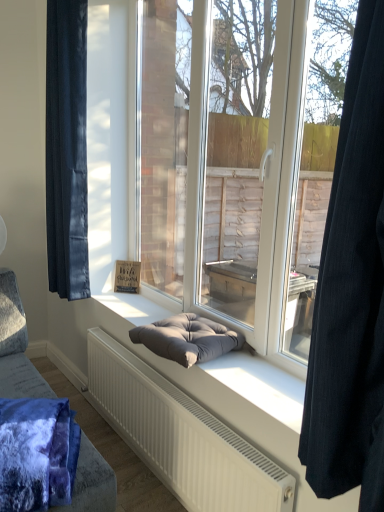
Describe the element at coordinates (241, 160) in the screenshot. I see `matte gray cushion at center` at that location.

Where is `velvet dark blue curtain at left, which appears as the 2th curtain when viewed from the right`? The height and width of the screenshot is (512, 384). velvet dark blue curtain at left, which appears as the 2th curtain when viewed from the right is located at coordinates (67, 149).

Describe the element at coordinates (187, 339) in the screenshot. This screenshot has height=512, width=384. I see `dark gray fabric footrest at center` at that location.

This screenshot has height=512, width=384. I want to click on dark gray cushion at center, so click(261, 385).

Identify the location of black fabric curtain at right, placed as the 1th curtain when sorted from right to left. (351, 292).

What are the coordinates of `matte gray cushion at center` in the screenshot? It's located at (241, 160).

Measure the distance between velvety blue blanket at lower left and matte gray cushion at center.

1.06 meters.

Is velvety blue blanket at lower left next to matte gray cushion at center?

velvety blue blanket at lower left is not next to matte gray cushion at center, and they're not touching.

Consider the image. Considering the relative sizes of velvety blue blanket at lower left and matte gray cushion at center in the image provided, is velvety blue blanket at lower left smaller than matte gray cushion at center?

Correct, velvety blue blanket at lower left occupies less space than matte gray cushion at center.

Which object is positioned more to the right, velvety blue blanket at lower left or matte gray cushion at center?

matte gray cushion at center.

Is matte gray cushion at center not close to black fabric curtain at right, the 2th curtain viewed from the left?

Absolutely, matte gray cushion at center is distant from black fabric curtain at right, the 2th curtain viewed from the left.

Find the location of a particular element. window on the left side of black fabric curtain at right, the 2th curtain viewed from the left is located at coordinates (241, 160).

From the image's perspective, is matte gray cushion at center below black fabric curtain at right, arranged as the 1th curtain when viewed from the front?

Actually, matte gray cushion at center appears above black fabric curtain at right, arranged as the 1th curtain when viewed from the front, in the image.

Between matte gray cushion at center and black fabric curtain at right, arranged as the 1th curtain when viewed from the front, which one is positioned behind?

matte gray cushion at center is further away from the camera.

Which of these two, matte gray cushion at center or velvety blue blanket at lower left, is thinner?

Thinner between the two is matte gray cushion at center.

Is point (295, 257) closer to viewer compared to point (14, 417)?

No, it is behind (14, 417).

In the scene shown: Is matte gray cushion at center looking in the opposite direction of velvety blue blanket at lower left?

No.

From the image's perspective, relative to velvety blue blanket at lower left, is matte gray cushion at center above or below?

Clearly, from the image's perspective, matte gray cushion at center is above velvety blue blanket at lower left.

Which is in front, velvet dark blue curtain at left, arranged as the first curtain when viewed from the left, or matte gray cushion at center?

matte gray cushion at center is closer to the camera.

Does velvet dark blue curtain at left, which is the second curtain from front to back, turn towards matte gray cushion at center?

No, velvet dark blue curtain at left, which is the second curtain from front to back, does not turn towards matte gray cushion at center.

How many degrees apart are the facing directions of velvet dark blue curtain at left, which appears as the 2th curtain when viewed from the right, and matte gray cushion at center?

They differ by 0.000116 degrees in their facing directions.

Are black fabric curtain at right, the 2th curtain viewed from the left, and velvety blue blanket at lower left far apart?

They are positioned close to each other.

Could you tell me if black fabric curtain at right, the 2th curtain viewed from the left, is turned towards velvety blue blanket at lower left?

No, black fabric curtain at right, the 2th curtain viewed from the left, is not turned towards velvety blue blanket at lower left.

From a real-world perspective, does black fabric curtain at right, the 2th curtain viewed from the left, stand above velvety blue blanket at lower left?

Yes.

Considering the relative sizes of velvet dark blue curtain at left, which appears as the 2th curtain when viewed from the right, and dark gray cushion at center in the image provided, is velvet dark blue curtain at left, which appears as the 2th curtain when viewed from the right, bigger than dark gray cushion at center?

Yes.

This screenshot has height=512, width=384. I want to click on curtain located behind the dark gray cushion at center, so [67, 149].

From the image's perspective, between velvet dark blue curtain at left, which is the second curtain from front to back, and dark gray cushion at center, who is located below?

dark gray cushion at center appears lower in the image.

Is velvet dark blue curtain at left, arranged as the first curtain when viewed from the left, taller than dark gray cushion at center?

Yes.

Looking at their sizes, would you say dark gray fabric footrest at center is wider or thinner than velvet dark blue curtain at left, the first curtain when ordered from back to front?

In the image, dark gray fabric footrest at center appears to be wider than velvet dark blue curtain at left, the first curtain when ordered from back to front.

How far apart are dark gray fabric footrest at center and velvet dark blue curtain at left, the first curtain when ordered from back to front?

dark gray fabric footrest at center is 36.82 inches from velvet dark blue curtain at left, the first curtain when ordered from back to front.

Between dark gray fabric footrest at center and velvet dark blue curtain at left, which appears as the 2th curtain when viewed from the right, which one appears on the left side from the viewer's perspective?

Positioned to the left is velvet dark blue curtain at left, which appears as the 2th curtain when viewed from the right.

Are dark gray fabric footrest at center and velvet dark blue curtain at left, which appears as the 2th curtain when viewed from the right, located far from each other?

dark gray fabric footrest at center is actually quite close to velvet dark blue curtain at left, which appears as the 2th curtain when viewed from the right.

Where is `window that is above the velvety blue blanket at lower left (from the image's perspective)`? window that is above the velvety blue blanket at lower left (from the image's perspective) is located at coordinates (241, 160).

Where is `window above the black fabric curtain at right, placed as the 1th curtain when sorted from right to left (from a real-world perspective)`? This screenshot has height=512, width=384. window above the black fabric curtain at right, placed as the 1th curtain when sorted from right to left (from a real-world perspective) is located at coordinates (241, 160).

Looking at the image, which one is located closer to matte gray cushion at center, velvet dark blue curtain at left, which is the second curtain from front to back, or dark gray fabric footrest at center?

Among the two, dark gray fabric footrest at center is located nearer to matte gray cushion at center.

Estimate the real-world distances between objects in this image. Which object is further from black fabric curtain at right, placed as the 1th curtain when sorted from right to left, dark gray cushion at center or dark gray fabric footrest at center?

The object further to black fabric curtain at right, placed as the 1th curtain when sorted from right to left, is dark gray fabric footrest at center.

Which object lies further to the anchor point dark gray fabric footrest at center, black fabric curtain at right, the 2th curtain viewed from the left, or velvet dark blue curtain at left, which appears as the 2th curtain when viewed from the right?

velvet dark blue curtain at left, which appears as the 2th curtain when viewed from the right, is further to dark gray fabric footrest at center.

Consider the image. Considering their positions, is dark gray cushion at center positioned further to dark gray fabric footrest at center than black fabric curtain at right, placed as the 1th curtain when sorted from right to left?

black fabric curtain at right, placed as the 1th curtain when sorted from right to left.

When comparing their distances from velvety blue blanket at lower left, does dark gray fabric footrest at center or dark gray cushion at center seem closer?

The object closer to velvety blue blanket at lower left is dark gray fabric footrest at center.

Estimate the real-world distances between objects in this image. Which object is further from velvet dark blue curtain at left, arranged as the first curtain when viewed from the left, dark gray cushion at center or dark gray fabric footrest at center?

Based on the image, dark gray cushion at center appears to be further to velvet dark blue curtain at left, arranged as the first curtain when viewed from the left.

Considering their positions, is black fabric curtain at right, the 2th curtain viewed from the left, positioned closer to dark gray cushion at center than velvet dark blue curtain at left, which is the second curtain from front to back?

The object closer to dark gray cushion at center is black fabric curtain at right, the 2th curtain viewed from the left.

Considering their positions, is dark gray fabric footrest at center positioned closer to black fabric curtain at right, placed as the 1th curtain when sorted from right to left, than velvety blue blanket at lower left?

Among the two, dark gray fabric footrest at center is located nearer to black fabric curtain at right, placed as the 1th curtain when sorted from right to left.

I want to click on curtain between matte gray cushion at center and velvety blue blanket at lower left in the vertical direction, so click(351, 292).

This screenshot has height=512, width=384. Identify the location of footrest between velvet dark blue curtain at left, the first curtain when ordered from back to front, and dark gray cushion at center in the up-down direction. (187, 339).

Find the location of a particular element. This screenshot has height=512, width=384. window sill between matte gray cushion at center and velvety blue blanket at lower left in the vertical direction is located at coordinates (261, 385).

You are a GUI agent. You are given a task and a screenshot of the screen. Output one action in this format:
    pyautogui.click(x=<x>, y=<y>)
    Task: Click on the footrest between velvety blue blanket at lower left and black fabric curtain at right, arranged as the 1th curtain when viewed from the front, in the horizontal direction
    Image resolution: width=384 pixels, height=512 pixels.
    Given the screenshot: What is the action you would take?
    pyautogui.click(x=187, y=339)